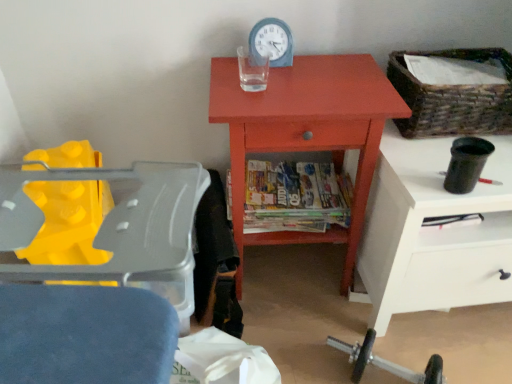
I want to click on vacant space in front of blue plastic clock at upper center, so click(x=275, y=87).